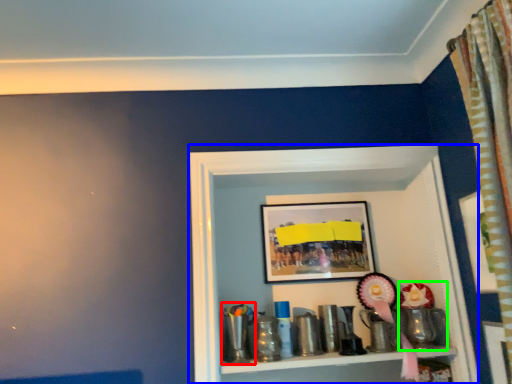
Question: Based on their relative distances, which object is nearer to toy (highlighted by a red box)? Choose from shelf (highlighted by a blue box) and toy (highlighted by a green box).

Choices:
 (A) shelf
 (B) toy

Answer: (A)